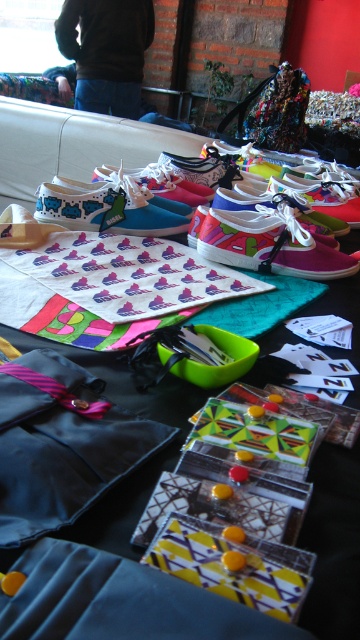
Which is behind, point (186, 396) or point (117, 188)?

Point (117, 188)

The height and width of the screenshot is (640, 360). Describe the element at coordinates (335, 545) in the screenshot. I see `matte plastic shoes at center` at that location.

Locate an element on the screen. The height and width of the screenshot is (640, 360). matte plastic shoes at center is located at coordinates (335, 545).

Can you confirm if matte pink canvas shoes at center is smaller than matte pink sneakers at center?

Incorrect, matte pink canvas shoes at center is not smaller in size than matte pink sneakers at center.

Describe the element at coordinates (272, 246) in the screenshot. I see `matte pink canvas shoes at center` at that location.

This screenshot has height=640, width=360. I want to click on matte pink canvas shoes at center, so click(272, 246).

Based on the photo, does matte pink canvas sneakers at center come in front of blue matte sneakers at center?

Yes, matte pink canvas sneakers at center is closer to the viewer.

At what (x,y) coordinates should I click in order to perform the action: click on matte pink canvas sneakers at center. Please return your answer as a coordinate pair (x, y). This screenshot has height=640, width=360. Looking at the image, I should click on (270, 244).